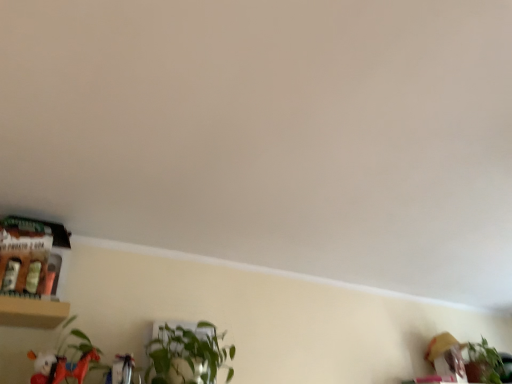
This screenshot has height=384, width=512. Describe the element at coordinates (187, 355) in the screenshot. I see `green leafy plant at center, the 2th houseplant in the bottom-to-top sequence` at that location.

The image size is (512, 384). What do you see at coordinates (44, 367) in the screenshot?
I see `matte white plush at lower left` at bounding box center [44, 367].

Identify the location of green leafy plant at lower right, which is counted as the first houseplant, starting from the right. This screenshot has width=512, height=384. (484, 363).

From a real-world perspective, is matte white plush at lower left positioned over green leafy plant at center, which is the 2th houseplant in right-to-left order, based on gravity?

No, from a real-world perspective, matte white plush at lower left is not on top of green leafy plant at center, which is the 2th houseplant in right-to-left order.

Who is shorter, matte white plush at lower left or green leafy plant at center, the first houseplant viewed from the left?

Standing shorter between the two is matte white plush at lower left.

How much distance is there between matte white plush at lower left and green leafy plant at center, the first houseplant viewed from the left?

matte white plush at lower left and green leafy plant at center, the first houseplant viewed from the left, are 19.28 inches apart from each other.

Which of these two, matte white plush at lower left or green leafy plant at center, the 2th houseplant in the bottom-to-top sequence, is smaller?

matte white plush at lower left is smaller.

Does point (192, 332) come closer to viewer compared to point (480, 377)?

Yes, point (192, 332) is closer to viewer.

Can you confirm if green leafy plant at center, which is the 2th houseplant in right-to-left order, is shorter than green leafy plant at lower right, placed as the 2th houseplant when sorted from top to bottom?

Yes, green leafy plant at center, which is the 2th houseplant in right-to-left order, is shorter than green leafy plant at lower right, placed as the 2th houseplant when sorted from top to bottom.

At what (x,y) coordinates should I click in order to perform the action: click on houseplant in front of the green leafy plant at lower right, the 2th houseplant viewed from the left. Please return your answer as a coordinate pair (x, y). The image size is (512, 384). Looking at the image, I should click on (187, 355).

Does green leafy plant at center, positioned as the first houseplant in front-to-back order, touch green leafy plant at lower right, the 2th houseplant viewed from the left?

There is a gap between green leafy plant at center, positioned as the first houseplant in front-to-back order, and green leafy plant at lower right, the 2th houseplant viewed from the left.

Between matte white plush at lower left and green leafy plant at lower right, placed as the 2th houseplant when sorted from top to bottom, which one appears on the left side from the viewer's perspective?

Positioned to the left is matte white plush at lower left.

Is matte white plush at lower left looking in the opposite direction of green leafy plant at lower right, which appears as the first houseplant when viewed from the back?

matte white plush at lower left is not turned away from green leafy plant at lower right, which appears as the first houseplant when viewed from the back.

Looking at this image, from their relative heights in the image, would you say matte white plush at lower left is taller or shorter than green leafy plant at lower right, which appears as the first houseplant when viewed from the back?

In the image, matte white plush at lower left appears to be shorter than green leafy plant at lower right, which appears as the first houseplant when viewed from the back.

Is point (46, 356) closer to camera compared to point (477, 359)?

That is True.

Considering the points (163, 383) and (40, 380), which point is behind, point (163, 383) or point (40, 380)?

The point (163, 383) is behind.

In order to click on toy on the left of green leafy plant at center, which is the 2th houseplant in right-to-left order in this screenshot , I will do `click(44, 367)`.

From a real-world perspective, which object rests below the other?

From a 3D spatial view, matte white plush at lower left is below.

How many degrees apart are the facing directions of green leafy plant at center, positioned as the first houseplant in front-to-back order, and matte white plush at lower left?

There is a 1.82-degree angle between the facing directions of green leafy plant at center, positioned as the first houseplant in front-to-back order, and matte white plush at lower left.

Would you say green leafy plant at center, the first houseplant viewed from the left, is part of green leafy plant at lower right, placed as the 2th houseplant when sorted from top to bottom,'s contents?

No, green leafy plant at center, the first houseplant viewed from the left, is not surrounded by green leafy plant at lower right, placed as the 2th houseplant when sorted from top to bottom.

Is green leafy plant at lower right, placed as the 1th houseplant when sorted from bottom to top, next to green leafy plant at center, positioned as the first houseplant in front-to-back order, and touching it?

No, green leafy plant at lower right, placed as the 1th houseplant when sorted from bottom to top, is not making contact with green leafy plant at center, positioned as the first houseplant in front-to-back order.

From a real-world perspective, is green leafy plant at lower right, placed as the 1th houseplant when sorted from bottom to top, positioned under green leafy plant at center, the 1th houseplant viewed from the top, based on gravity?

Actually, green leafy plant at lower right, placed as the 1th houseplant when sorted from bottom to top, is physically above green leafy plant at center, the 1th houseplant viewed from the top, in the real world.

Between green leafy plant at lower right, which ranks as the 2th houseplant in front-to-back order, and green leafy plant at center, the 1th houseplant viewed from the top, which one has smaller size?

green leafy plant at lower right, which ranks as the 2th houseplant in front-to-back order.

From the picture: Can you confirm if green leafy plant at lower right, which ranks as the 2th houseplant in front-to-back order, is smaller than matte white plush at lower left?

Actually, green leafy plant at lower right, which ranks as the 2th houseplant in front-to-back order, might be larger than matte white plush at lower left.

Considering the positions of points (482, 369) and (48, 364), is point (482, 369) farther from camera compared to point (48, 364)?

Yes, it is behind point (48, 364).

Is green leafy plant at lower right, placed as the 2th houseplant when sorted from top to bottom, taller or shorter than matte white plush at lower left?

Clearly, green leafy plant at lower right, placed as the 2th houseplant when sorted from top to bottom, is taller compared to matte white plush at lower left.

From a real-world perspective, count 1st houseplants upward from the matte white plush at lower left and point to it. Please provide its 2D coordinates.

[(187, 355)]

Find the location of a particular element. Image resolution: width=512 pixels, height=384 pixels. houseplant that appears below the green leafy plant at center, positioned as the first houseplant in front-to-back order (from the image's perspective) is located at coordinates (484, 363).

Looking at the image, which one is located closer to green leafy plant at center, the first houseplant viewed from the left, green leafy plant at lower right, placed as the 1th houseplant when sorted from bottom to top, or matte white plush at lower left?

matte white plush at lower left is positioned closer to the anchor green leafy plant at center, the first houseplant viewed from the left.

Based on their spatial positions, is matte white plush at lower left or green leafy plant at center, the first houseplant viewed from the left, closer to green leafy plant at lower right, the 2th houseplant viewed from the left?

green leafy plant at center, the first houseplant viewed from the left.

Estimate the real-world distances between objects in this image. Which object is closer to matte white plush at lower left, green leafy plant at center, the first houseplant viewed from the left, or green leafy plant at lower right, which ranks as the 2th houseplant in front-to-back order?

green leafy plant at center, the first houseplant viewed from the left, is positioned closer to the anchor matte white plush at lower left.

Which object lies further to the anchor point green leafy plant at lower right, which ranks as the 2th houseplant in front-to-back order, green leafy plant at center, the first houseplant viewed from the left, or matte white plush at lower left?

matte white plush at lower left lies further to green leafy plant at lower right, which ranks as the 2th houseplant in front-to-back order, than the other object.

Considering their positions, is green leafy plant at lower right, placed as the 2th houseplant when sorted from top to bottom, positioned further to matte white plush at lower left than green leafy plant at center, the first houseplant viewed from the left?

The object further to matte white plush at lower left is green leafy plant at lower right, placed as the 2th houseplant when sorted from top to bottom.

Based on their spatial positions, is matte white plush at lower left or green leafy plant at lower right, which ranks as the 2th houseplant in front-to-back order, closer to green leafy plant at center, positioned as the first houseplant in front-to-back order?

matte white plush at lower left is positioned closer to the anchor green leafy plant at center, positioned as the first houseplant in front-to-back order.

Image resolution: width=512 pixels, height=384 pixels. Find the location of `houseplant situated between matte white plush at lower left and green leafy plant at lower right, which ranks as the 2th houseplant in front-to-back order, from left to right`. houseplant situated between matte white plush at lower left and green leafy plant at lower right, which ranks as the 2th houseplant in front-to-back order, from left to right is located at coordinates (187, 355).